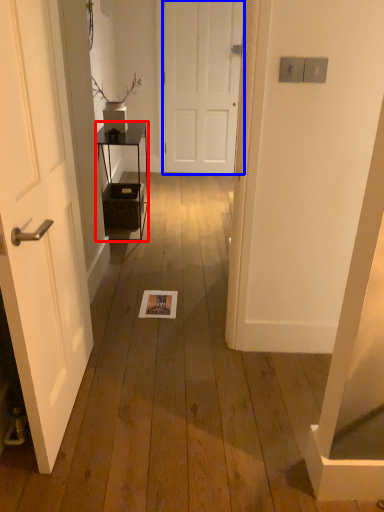
Question: Which point is further to the camera, furniture (highlighted by a red box) or door (highlighted by a blue box)?

Choices:
 (A) furniture
 (B) door

Answer: (B)